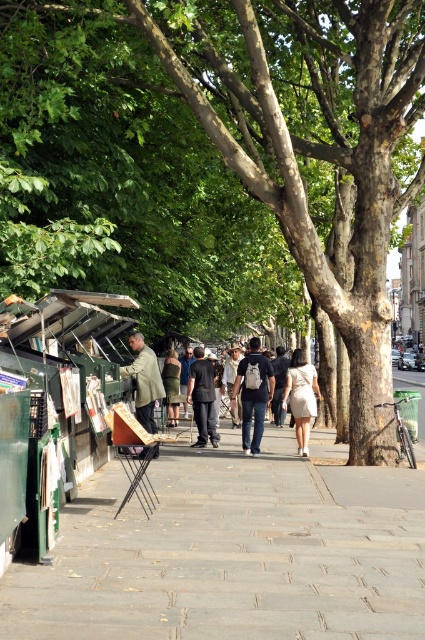
Question: Is dark blue jeans at center below green matte jacket at left?

Choices:
 (A) yes
 (B) no

Answer: (A)

Question: Which point is closer to the camera?

Choices:
 (A) brown rough tree at center
 (B) white cotton dress at center

Answer: (A)

Question: Is dark blue jeans at center further to the viewer compared to white cotton dress at center?

Choices:
 (A) yes
 (B) no

Answer: (B)

Question: Which point appears closest to the camera in this image?

Choices:
 (A) (189, 552)
 (B) (308, 420)
 (C) (158, 16)
 (D) (141, 384)

Answer: (A)

Question: Is brown rough tree at center to the left of dark blue jeans at center from the viewer's perspective?

Choices:
 (A) yes
 (B) no

Answer: (B)

Question: Which point is farther from the camera taking this photo?

Choices:
 (A) (306, 378)
 (B) (255, 442)
 (C) (319, 502)
 (D) (156, 380)

Answer: (A)